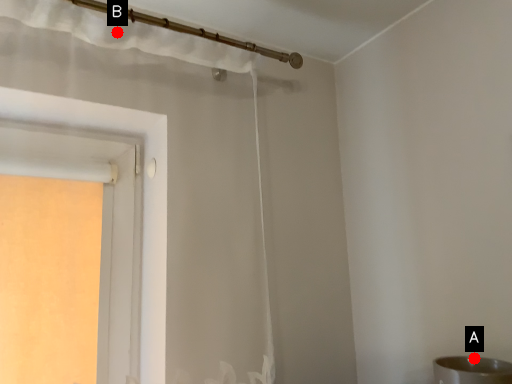
Question: Two points are circled on the image, labeled by A and B beside each circle. Which point is farther to the camera?

Choices:
 (A) A is further
 (B) B is further

Answer: (B)